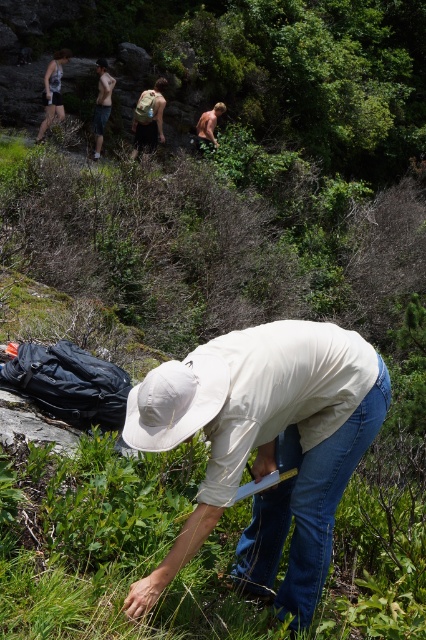
You are a hiker trying to locate your belongings. You see a white cotton hat at center and a light brown fur dog at upper center. Which item is positioned lower in the image?

The white cotton hat at center is below the light brown fur dog at upper center, so the hat is lower in the image.

Based on the photo, you are a hiker trying to locate a specific spot marked by coordinates on a map. The map shows a point at coordinates (101, 102). According to the scene, what is this point likely marking?

Result: The point at coordinates (101, 102) indicates the tan skin torso at upper center, so this point is likely marking the location of the person examining something on the ground with a tape measure.